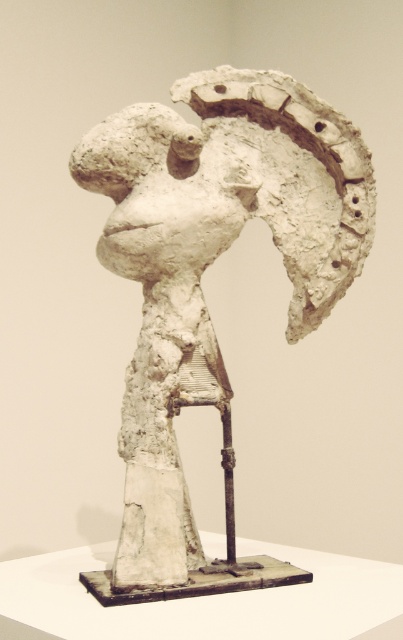
You are an art installer and need to place a decorative light exactly at the center of the wall. The wall has coordinates from 0 to 1 on both axes. Where should you place the light to ensure it aligns with the center of the white clay sculpture at center?

The white clay sculpture at center is located at point (201, 289), so you should place the decorative light at coordinates 0.452 and 0.499 to align with its center.

You are an art installer who needs to place a protective cover over the white clay sculpture at center and the white clay head at center. Which object requires a larger cover?

The white clay sculpture at center requires a larger cover because it is larger in size than the white clay head at center.

You are standing in front of the white clay sculpture at center with a camera that has a focal length of 50mm. If the recommended distance for capturing a clear photo of this sculpture is at least 1.5 meters, will you be able to take a clear photo from your current position?

The white clay sculpture at center and camera are 1.43 meters apart, which is less than the recommended 1.5 meters. Therefore, you will not be able to take a clear photo from your current position.